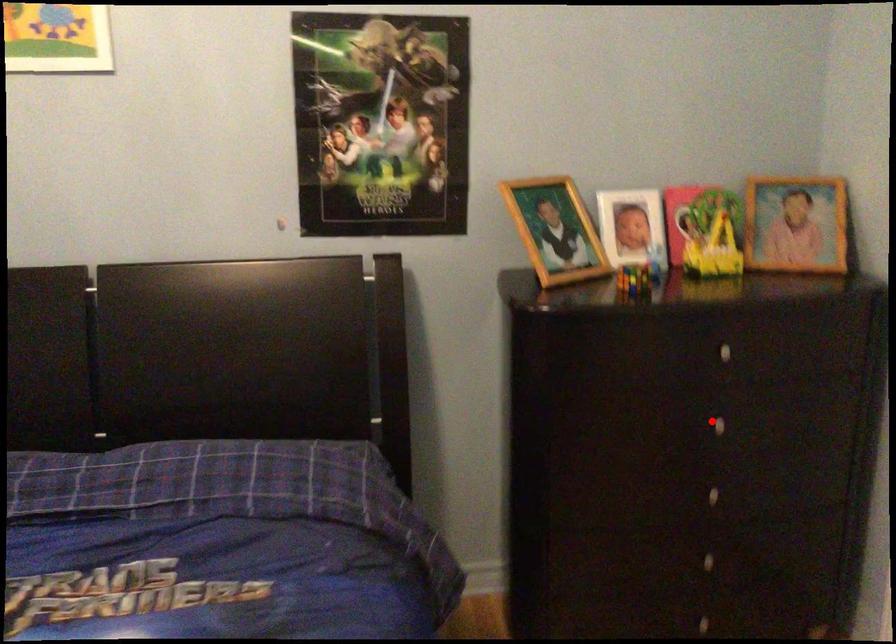
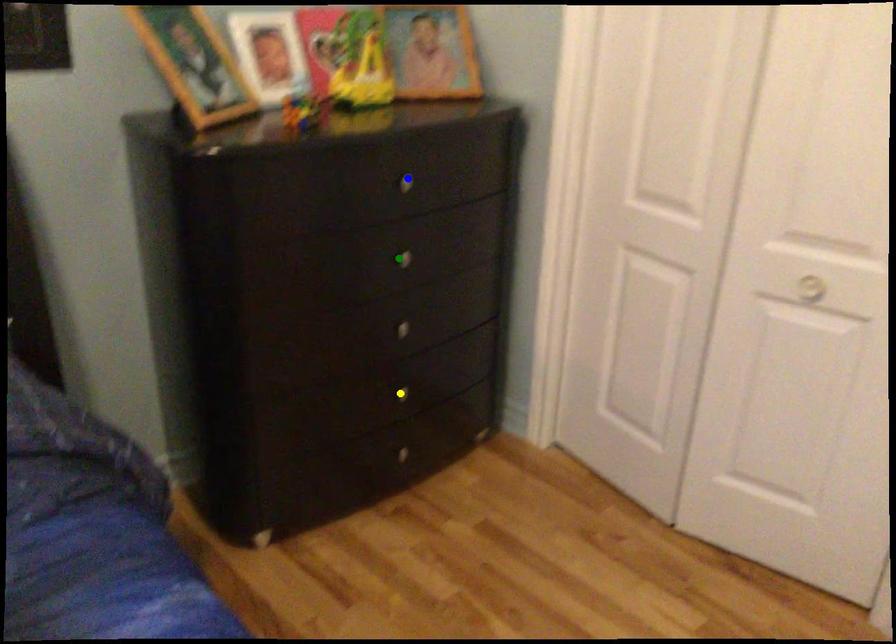
Question: I am providing you with two images of the same scene from different viewpoints. A red point is marked on the first image. You are given multiple points on the second image. Which mark in image 2 goes with the point in image 1?

Choices:
 (A) green point
 (B) blue point
 (C) yellow point

Answer: (A)